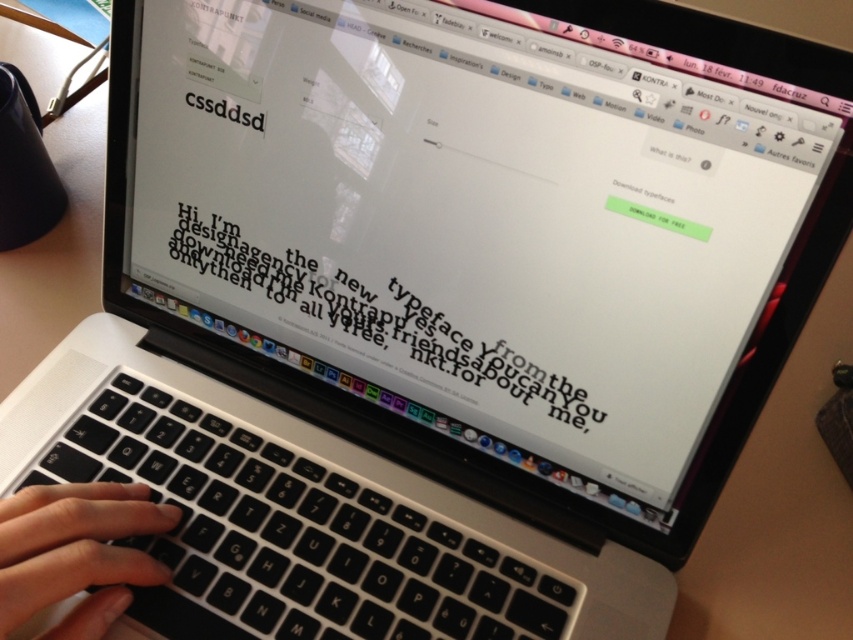
Where is `white paper text at center`? Image resolution: width=853 pixels, height=640 pixels. white paper text at center is located at coordinates (358, 326).

Who is lower down, white paper text at center or black matte hand at center?

black matte hand at center

Where is `white paper text at center`? This screenshot has height=640, width=853. white paper text at center is located at coordinates (358, 326).

Find the location of `white paper text at center`. white paper text at center is located at coordinates (358, 326).

Does black matte keyboard at center have a greater height compared to white paper text at center?

In fact, black matte keyboard at center may be shorter than white paper text at center.

Is point (270, 577) positioned after point (312, 312)?

That is False.

Between point (102, 410) and point (297, 291), which one is positioned behind?

The point (102, 410) is behind.

At what (x,y) coordinates should I click in order to perform the action: click on black matte keyboard at center. Please return your answer as a coordinate pair (x, y). This screenshot has height=640, width=853. Looking at the image, I should click on (289, 532).

Which is in front, point (218, 566) or point (4, 561)?

Point (4, 561)

Does point (135, 396) come closer to viewer compared to point (13, 586)?

That is False.

Measure the distance between point (148, 387) and camera.

Point (148, 387) is 22.39 inches away from camera.

The image size is (853, 640). Find the location of `black matte keyboard at center`. black matte keyboard at center is located at coordinates (289, 532).